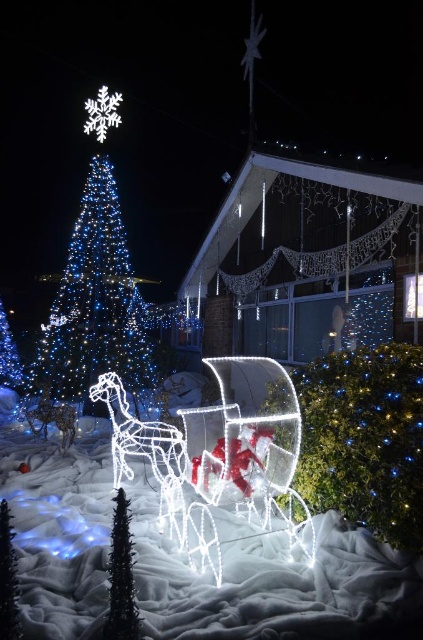
You are planning to place a new decoration between the illuminated plastic tree at center and the black matte christmas tree at lower left. Given that the space between them is 5.16 feet, will a decoration that requires 5 feet of space fit?

The distance between the illuminated plastic tree at center and the black matte christmas tree at lower left is 5.16 feet. Since the decoration requires 5 feet of space, it will fit as there is enough space available.

You are a guest at a Christmas party and want to take a photo with both the illuminated plastic tree at upper left and the black matte christmas tree at lower left in the background. Can you position yourself so that both trees are visible in the frame?

The illuminated plastic tree at upper left is above the black matte christmas tree at lower left, so if you position yourself in front of them at a lower angle, you can include both trees in the photo frame by looking upwards to capture the upper tree and ensure the lower tree remains in view.